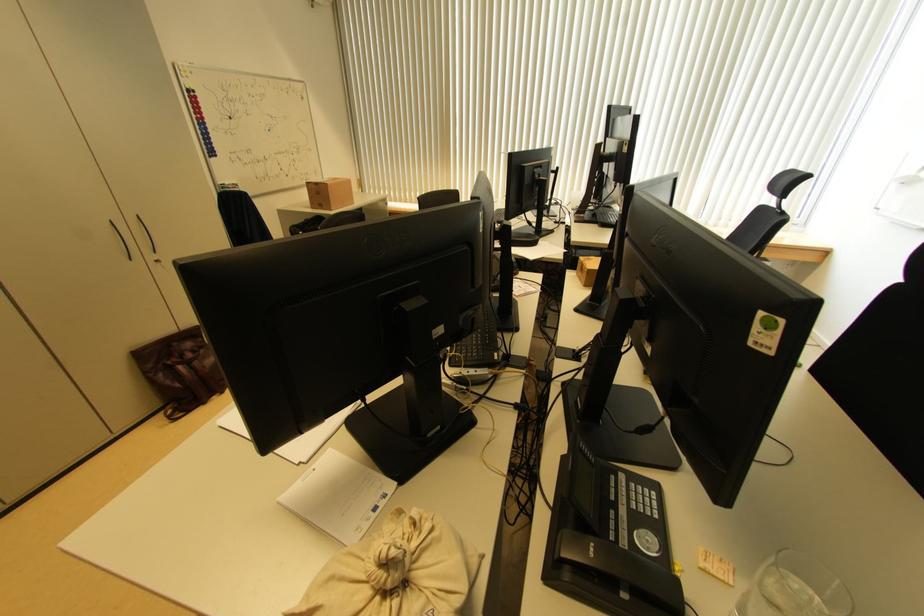
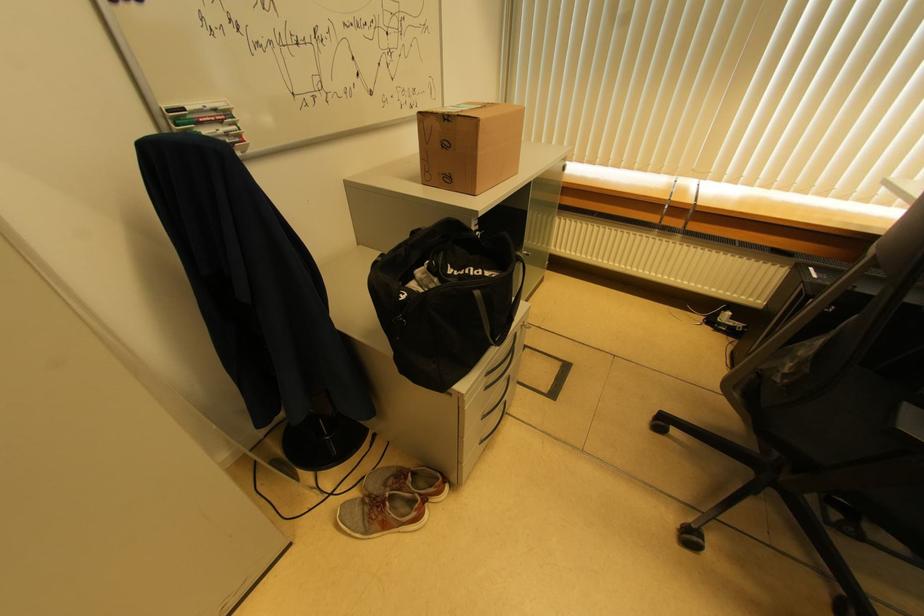
Locate, in the second image, the point that corresponds to point (238, 188) in the first image.

(229, 116)